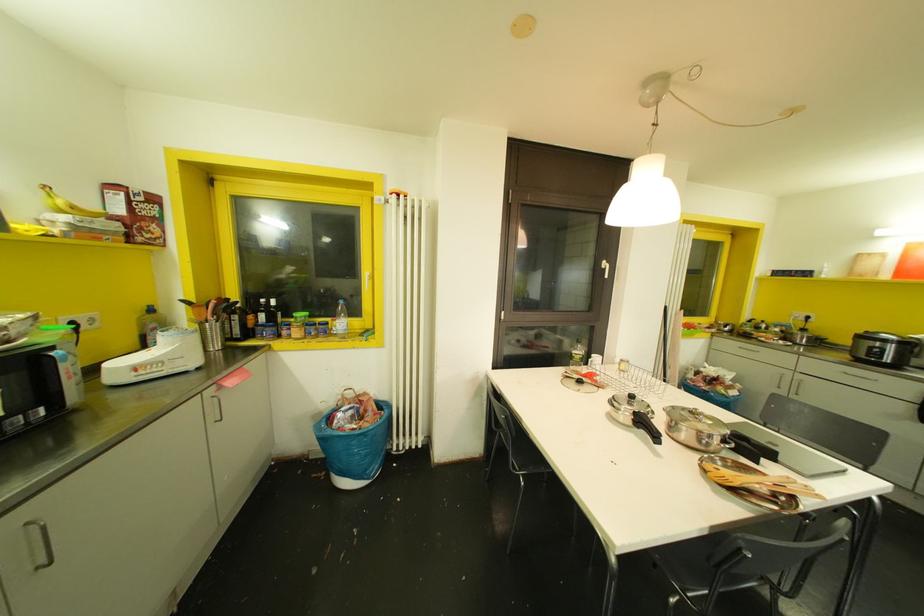
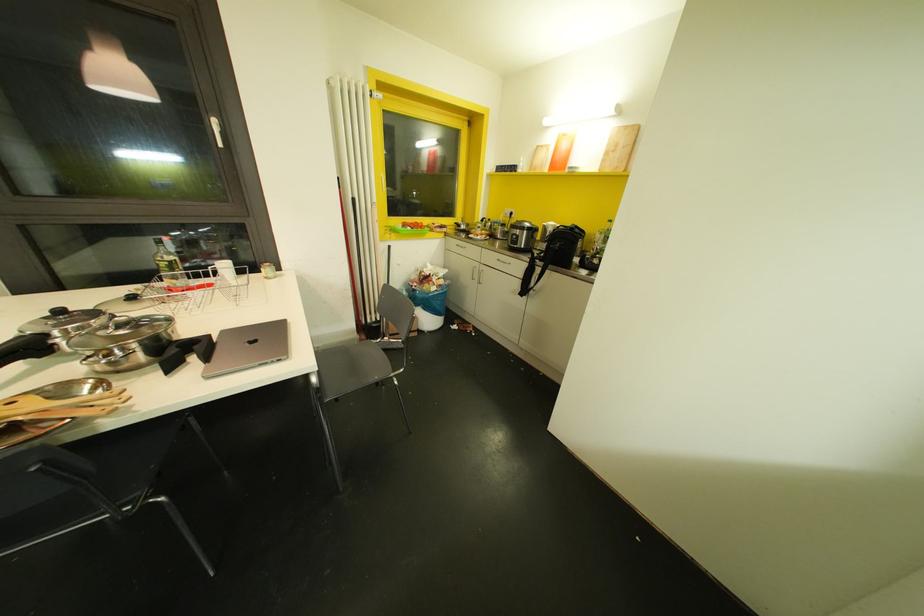
Question: Which direction would the cameraman need to move to produce the second image? Reply with the corresponding letter.

Choices:
 (A) Left
 (B) Right
 (C) Forward
 (D) Backward

Answer: (B)